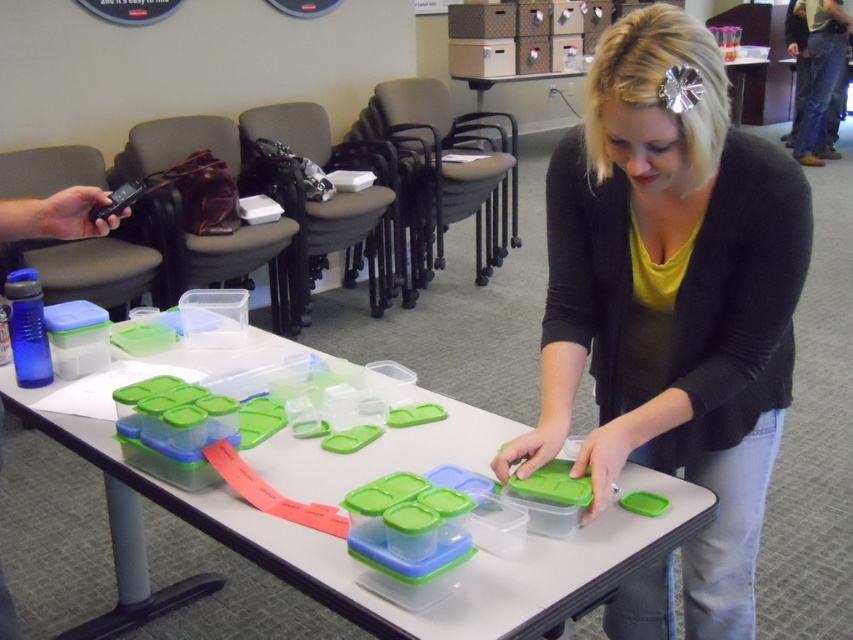
Where is `matte black sweater at center`? This screenshot has height=640, width=853. matte black sweater at center is located at coordinates (672, 296).

Can you confirm if matte black sweater at center is positioned to the right of jeans at right?

No, matte black sweater at center is not to the right of jeans at right.

Is point (550, 188) positioned before point (816, 120)?

Yes, point (550, 188) is in front of point (816, 120).

Identify the location of matte black sweater at center. (672, 296).

Does clear plastic containers at center have a lesser width compared to jeans at right?

Incorrect, clear plastic containers at center's width is not less than jeans at right's.

Does point (492, 416) come behind point (836, 58)?

No.

Where is `clear plastic containers at center`? The image size is (853, 640). clear plastic containers at center is located at coordinates (347, 557).

Does matte black sweater at center appear over clear plastic containers at center?

Indeed, matte black sweater at center is positioned over clear plastic containers at center.

How far apart are matte black sweater at center and clear plastic containers at center?

matte black sweater at center and clear plastic containers at center are 13.59 inches apart.

Who is more distant from viewer, (624, 77) or (451, 636)?

The point (624, 77) is behind.

This screenshot has height=640, width=853. Identify the location of matte black sweater at center. (672, 296).